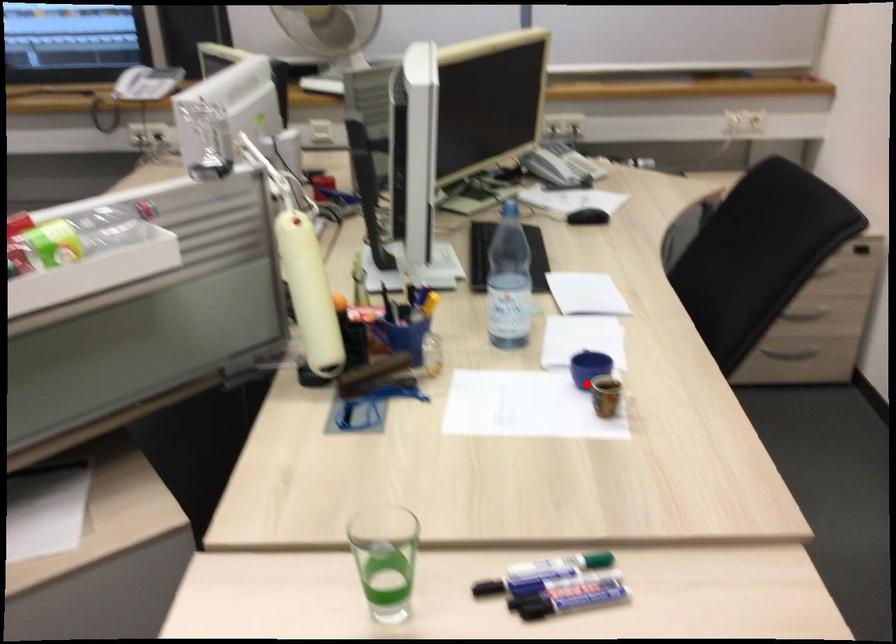
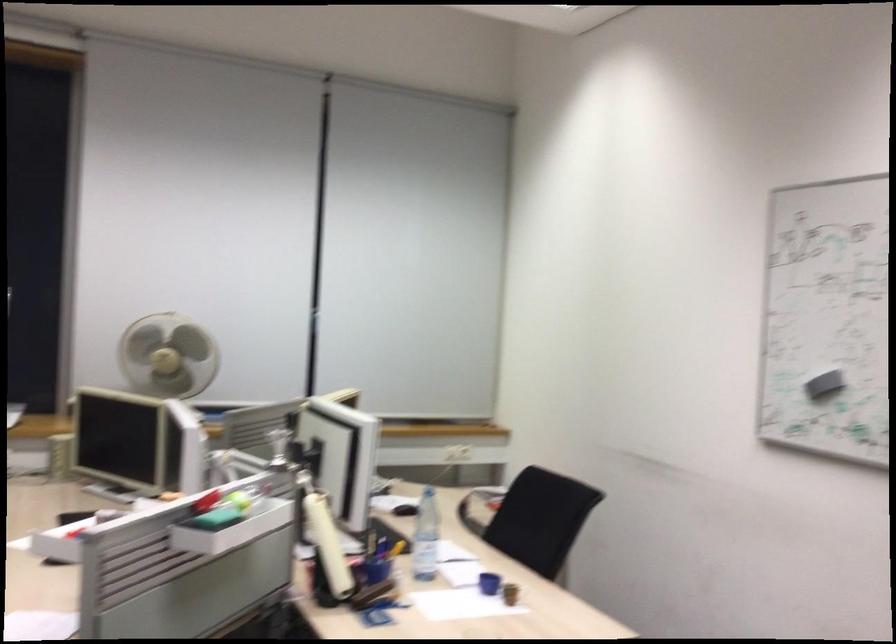
Question: A red point is marked in image1. In image2, is the corresponding 3D point closer to the camera or farther? Reply with the corresponding letter.

Choices:
 (A) The corresponding 3D point is closer.
 (B) The corresponding 3D point is farther.

Answer: (B)